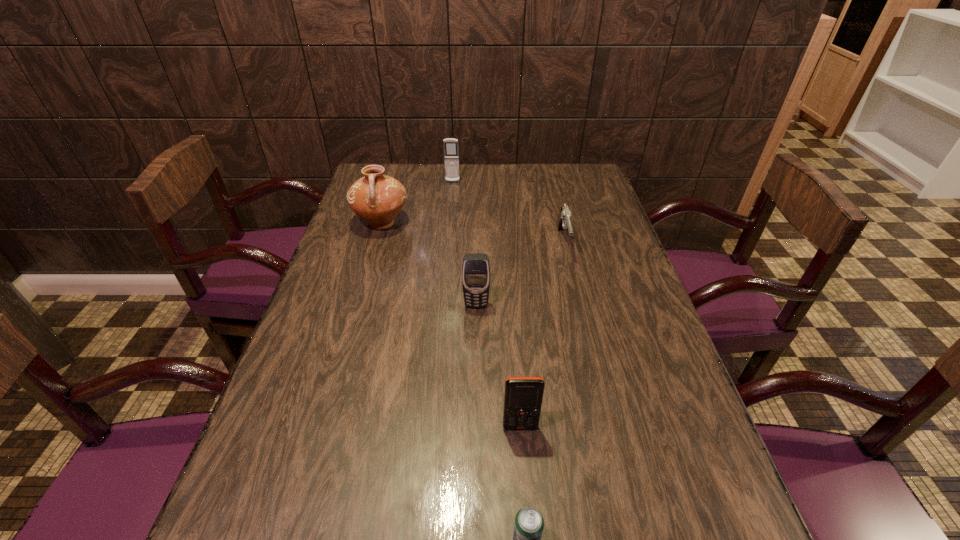
Find the location of a particular element. The image size is (960, 540). free spot located on the front face of the second nearest cellular telephone is located at coordinates (476, 364).

Locate an element on the screen. The image size is (960, 540). vacant space located 0.110m on the screen of the nearest cellular telephone is located at coordinates (525, 489).

Locate an element on the screen. This screenshot has height=540, width=960. vacant area situated at the muzzle of the rightmost object is located at coordinates (582, 319).

Locate an element on the screen. object present at the far edge is located at coordinates point(451,154).

Where is `object present at the left edge`? object present at the left edge is located at coordinates (376, 198).

Image resolution: width=960 pixels, height=540 pixels. In the image, there is a desktop. Find the location of `blank space at the far edge`. blank space at the far edge is located at coordinates (427, 166).

The image size is (960, 540). What are the coordinates of `free space at the left edge of the desktop` in the screenshot? It's located at (354, 314).

Where is `free space at the right edge of the desktop`? free space at the right edge of the desktop is located at coordinates (657, 401).

At what (x,y) coordinates should I click in order to perform the action: click on free region at the far right corner of the desktop. Please return your answer as a coordinate pair (x, y). This screenshot has height=540, width=960. Looking at the image, I should click on (587, 191).

Image resolution: width=960 pixels, height=540 pixels. Identify the location of vacant space in between the pottery and the farthest cellular telephone. (418, 203).